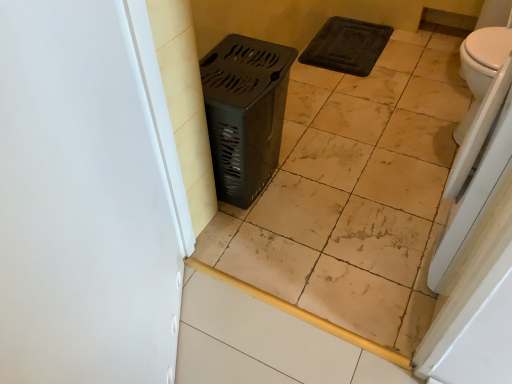
Question: Can you confirm if white matte screen door at left is wider than beige ceramic tile at center?

Choices:
 (A) yes
 (B) no

Answer: (B)

Question: Is white matte screen door at left positioned before beige ceramic tile at center?

Choices:
 (A) no
 (B) yes

Answer: (B)

Question: Is white matte screen door at left oriented towards beige ceramic tile at center?

Choices:
 (A) yes
 (B) no

Answer: (A)

Question: Considering the relative sizes of white matte screen door at left and beige ceramic tile at center in the image provided, is white matte screen door at left bigger than beige ceramic tile at center?

Choices:
 (A) yes
 (B) no

Answer: (B)

Question: From a real-world perspective, is white matte screen door at left on top of beige ceramic tile at center?

Choices:
 (A) yes
 (B) no

Answer: (A)

Question: Is point (209, 76) closer or farther from the camera than point (475, 178)?

Choices:
 (A) farther
 (B) closer

Answer: (A)

Question: From a real-world perspective, is metallic gray laundry basket at center above or below white glossy toilet at right?

Choices:
 (A) below
 (B) above

Answer: (A)

Question: Is metallic gray laundry basket at center inside or outside of white glossy toilet at right?

Choices:
 (A) outside
 (B) inside

Answer: (A)

Question: In terms of size, does metallic gray laundry basket at center appear bigger or smaller than white glossy toilet at right?

Choices:
 (A) small
 (B) big

Answer: (B)

Question: Considering the positions of white glossy toilet at right and metallic gray laundry basket at center in the image, is white glossy toilet at right bigger or smaller than metallic gray laundry basket at center?

Choices:
 (A) big
 (B) small

Answer: (B)

Question: From a real-world perspective, relative to metallic gray laundry basket at center, is white glossy toilet at right vertically above or below?

Choices:
 (A) above
 (B) below

Answer: (A)

Question: Is point (444, 258) closer or farther from the camera than point (266, 77)?

Choices:
 (A) farther
 (B) closer

Answer: (B)

Question: Is white glossy toilet at right taller or shorter than metallic gray laundry basket at center?

Choices:
 (A) tall
 (B) short

Answer: (A)

Question: From their relative heights in the image, would you say metallic gray laundry basket at center is taller or shorter than white glossy toilet at right?

Choices:
 (A) short
 (B) tall

Answer: (A)

Question: Choose the correct answer: Is metallic gray laundry basket at center inside white glossy toilet at right or outside it?

Choices:
 (A) outside
 (B) inside

Answer: (A)